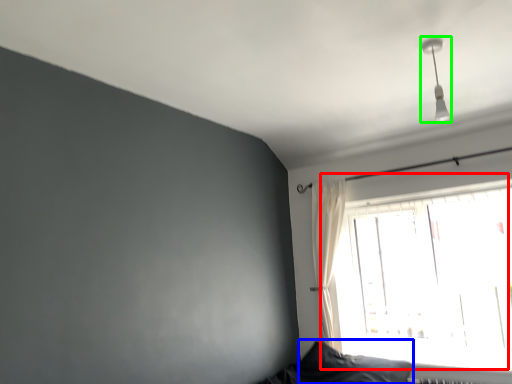
Question: Which is nearer to the window (highlighted by a red box)? pillow (highlighted by a blue box) or fixture (highlighted by a green box).

Choices:
 (A) pillow
 (B) fixture

Answer: (A)